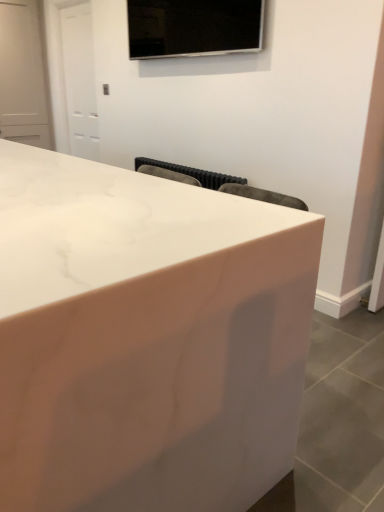
Describe the element at coordinates (193, 27) in the screenshot. I see `black glossy tv at upper center` at that location.

Identify the location of black glossy tv at upper center. This screenshot has width=384, height=512. (193, 27).

In order to face black glossy tv at upper center, should I rotate leftwards or rightwards?

Turn left by 1.374 degrees to look at black glossy tv at upper center.

Where is `white marble countertop at center`? white marble countertop at center is located at coordinates (146, 338).

The height and width of the screenshot is (512, 384). Describe the element at coordinates (146, 338) in the screenshot. I see `white marble countertop at center` at that location.

Measure the distance between point (56, 198) and camera.

The distance of point (56, 198) from camera is 4.24 feet.

Image resolution: width=384 pixels, height=512 pixels. I want to click on black glossy tv at upper center, so click(193, 27).

Based on their positions, is white marble countertop at center located to the left or right of black glossy tv at upper center?

Based on their positions, white marble countertop at center is located to the left of black glossy tv at upper center.

Is the depth of white marble countertop at center greater than that of black glossy tv at upper center?

No, it is not.

Considering the positions of point (156, 237) and point (184, 36), is point (156, 237) closer or farther from the camera than point (184, 36)?

Point (156, 237) is positioned closer to the camera compared to point (184, 36).

From the image's perspective, is white marble countertop at center on black glossy tv at upper center?

Actually, white marble countertop at center appears below black glossy tv at upper center in the image.

From a real-world perspective, between white marble countertop at center and black glossy tv at upper center, who is vertically lower?

white marble countertop at center is physically lower.

Is white marble countertop at center thinner than black glossy tv at upper center?

No.

Considering the relative sizes of white marble countertop at center and black glossy tv at upper center in the image provided, is white marble countertop at center taller than black glossy tv at upper center?

Yes.

Is white marble countertop at center smaller than black glossy tv at upper center?

Actually, white marble countertop at center might be larger than black glossy tv at upper center.

Choose the correct answer: Is white marble countertop at center inside black glossy tv at upper center or outside it?

white marble countertop at center is not enclosed by black glossy tv at upper center.

Are white marble countertop at center and black glossy tv at upper center located far from each other?

Indeed, white marble countertop at center is not near black glossy tv at upper center.

Is white marble countertop at center positioned with its back to black glossy tv at upper center?

No, white marble countertop at center is not facing away from black glossy tv at upper center.

How many degrees apart are the facing directions of white marble countertop at center and black glossy tv at upper center?

The angle between the facing direction of white marble countertop at center and the facing direction of black glossy tv at upper center is 89.3 degrees.

Image resolution: width=384 pixels, height=512 pixels. Identify the location of countertop located on the left of black glossy tv at upper center. (146, 338).

In the image, is black glossy tv at upper center on the left side or the right side of white marble countertop at center?

Clearly, black glossy tv at upper center is on the right of white marble countertop at center in the image.

From the picture: Considering their positions, is black glossy tv at upper center located in front of or behind white marble countertop at center?

In the image, black glossy tv at upper center appears behind white marble countertop at center.

Considering the positions of points (218, 47) and (74, 193), is point (218, 47) closer to camera compared to point (74, 193)?

No, (218, 47) is further to viewer.

From the image's perspective, would you say black glossy tv at upper center is positioned over white marble countertop at center?

Yes, from the image's perspective, black glossy tv at upper center is above white marble countertop at center.

From a real-world perspective, is black glossy tv at upper center physically below white marble countertop at center?

No, from a real-world perspective, black glossy tv at upper center is not beneath white marble countertop at center.

Considering the relative sizes of black glossy tv at upper center and white marble countertop at center in the image provided, is black glossy tv at upper center thinner than white marble countertop at center?

Correct, the width of black glossy tv at upper center is less than that of white marble countertop at center.

Is black glossy tv at upper center taller than white marble countertop at center?

In fact, black glossy tv at upper center may be shorter than white marble countertop at center.

Considering the sizes of objects black glossy tv at upper center and white marble countertop at center in the image provided, who is smaller, black glossy tv at upper center or white marble countertop at center?

black glossy tv at upper center.

Could white marble countertop at center be considered to be inside black glossy tv at upper center?

No.

Is black glossy tv at upper center positioned far away from white marble countertop at center?

Absolutely, black glossy tv at upper center is distant from white marble countertop at center.

Is black glossy tv at upper center aimed at white marble countertop at center?

No, black glossy tv at upper center is not oriented towards white marble countertop at center.

Can you tell me how much black glossy tv at upper center and white marble countertop at center differ in facing direction?

The angular difference between black glossy tv at upper center and white marble countertop at center is 89.3 degrees.

Where is `countertop located on the left of black glossy tv at upper center`? The height and width of the screenshot is (512, 384). countertop located on the left of black glossy tv at upper center is located at coordinates (146, 338).

Identify the location of television above the white marble countertop at center (from the image's perspective). (193, 27).

Locate an element on the screen. television lying behind the white marble countertop at center is located at coordinates click(193, 27).